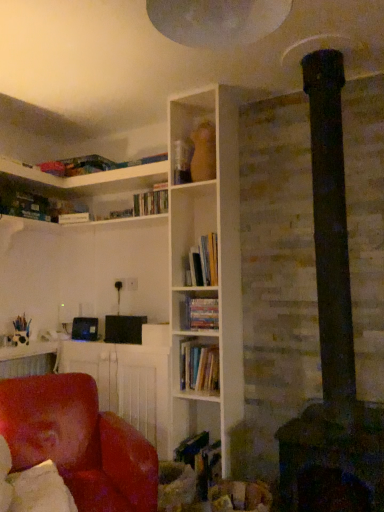
Question: Is hardcover books at center, which ranks as the second book in top-to-bottom order, wider than matte red chair at lower left?

Choices:
 (A) no
 (B) yes

Answer: (A)

Question: From a real-world perspective, is hardcover books at center, which ranks as the second book in top-to-bottom order, located higher than matte red chair at lower left?

Choices:
 (A) no
 (B) yes

Answer: (B)

Question: Considering the relative sizes of hardcover books at center, the second book ordered from the bottom, and matte red chair at lower left in the image provided, is hardcover books at center, the second book ordered from the bottom, taller than matte red chair at lower left?

Choices:
 (A) yes
 (B) no

Answer: (B)

Question: Considering the relative sizes of hardcover books at center, which ranks as the second book in top-to-bottom order, and matte red chair at lower left in the image provided, is hardcover books at center, which ranks as the second book in top-to-bottom order, thinner than matte red chair at lower left?

Choices:
 (A) no
 (B) yes

Answer: (B)

Question: From a real-world perspective, is hardcover books at center, which ranks as the second book in top-to-bottom order, positioned under matte red chair at lower left based on gravity?

Choices:
 (A) no
 (B) yes

Answer: (A)

Question: From the image's perspective, is hardcover books at center, acting as the first book starting from the top, located above or below leather at left?

Choices:
 (A) above
 (B) below

Answer: (A)

Question: From their relative heights in the image, would you say hardcover books at center, acting as the first book starting from the top, is taller or shorter than leather at left?

Choices:
 (A) tall
 (B) short

Answer: (B)

Question: Is hardcover books at center, the third book from the bottom, spatially inside leather at left, or outside of it?

Choices:
 (A) outside
 (B) inside

Answer: (A)

Question: Considering the positions of point (193, 256) and point (13, 398), is point (193, 256) closer or farther from the camera than point (13, 398)?

Choices:
 (A) farther
 (B) closer

Answer: (A)

Question: Considering the positions of point (198, 305) and point (200, 260), is point (198, 305) closer or farther from the camera than point (200, 260)?

Choices:
 (A) farther
 (B) closer

Answer: (B)

Question: Visually, is hardcover books at center, which ranks as the second book in top-to-bottom order, positioned to the left or to the right of hardcover books at center, acting as the first book starting from the top?

Choices:
 (A) left
 (B) right

Answer: (A)

Question: From a real-world perspective, is hardcover books at center, the second book ordered from the bottom, positioned above or below hardcover books at center, the third book from the bottom?

Choices:
 (A) below
 (B) above

Answer: (A)

Question: Based on their sizes in the image, would you say hardcover books at center, which ranks as the second book in top-to-bottom order, is bigger or smaller than hardcover books at center, the third book from the bottom?

Choices:
 (A) small
 (B) big

Answer: (A)

Question: Considering the relative positions of matte red chair at lower left and leather at left in the image provided, is matte red chair at lower left to the left or to the right of leather at left?

Choices:
 (A) left
 (B) right

Answer: (B)

Question: Choose the correct answer: Is matte red chair at lower left inside leather at left or outside it?

Choices:
 (A) outside
 (B) inside

Answer: (A)